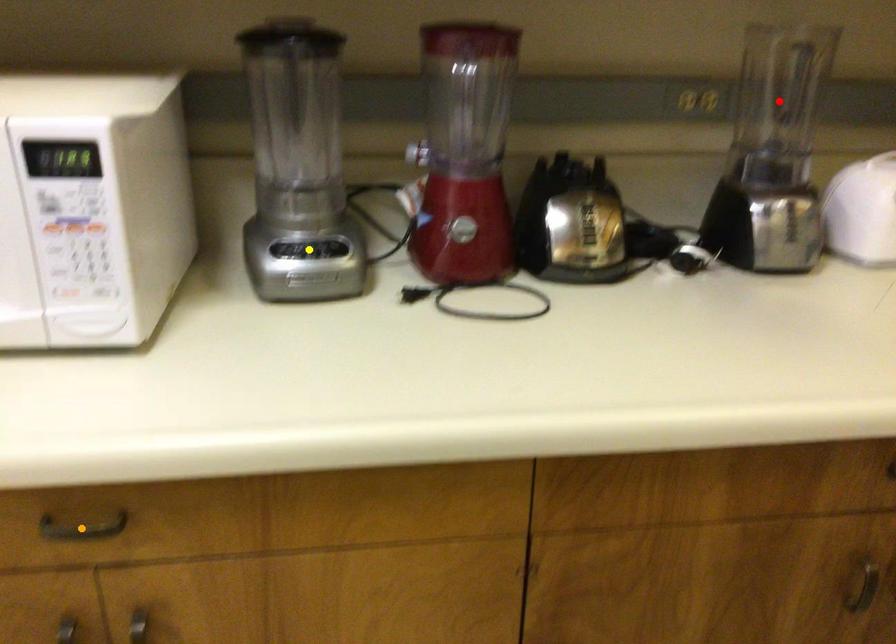
Order these from nearest to farthest:
red point, orange point, yellow point

1. orange point
2. yellow point
3. red point